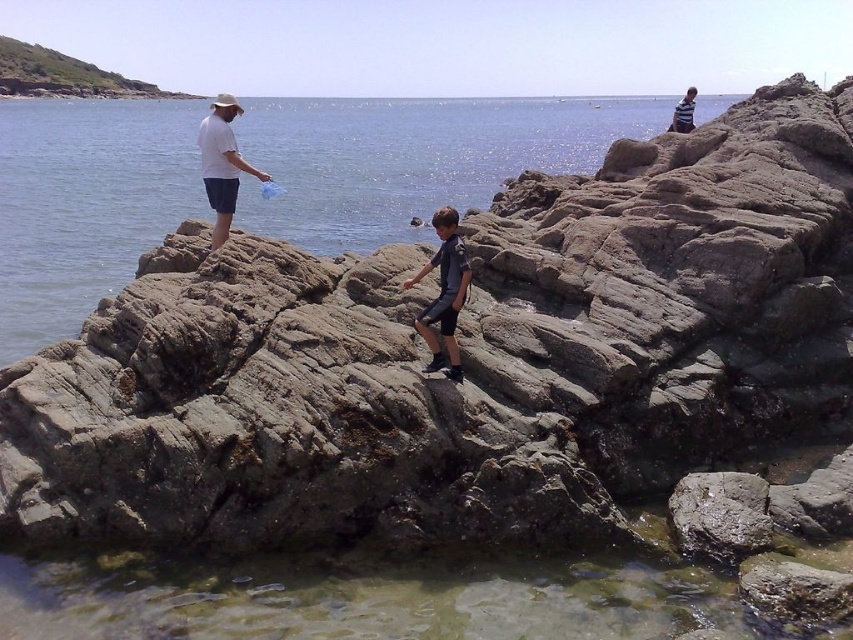
Question: Among these objects, which one is nearest to the camera?

Choices:
 (A) clear water at rocks center
 (B) gray rough rock at lower right
 (C) green grassy hillside at upper left
 (D) white matte shirt at upper left

Answer: (B)

Question: Does clear water at rocks center appear over white matte shirt at upper left?

Choices:
 (A) yes
 (B) no

Answer: (A)

Question: Which point is closer to the camera?

Choices:
 (A) (51, 76)
 (B) (201, 125)
 (C) (340, 243)
 (D) (691, 552)

Answer: (D)

Question: Is green grassy hillside at upper left bigger than white matte shirt at upper left?

Choices:
 (A) yes
 (B) no

Answer: (A)

Question: Which point is farther from the camera taking this photo?

Choices:
 (A) (97, 81)
 (B) (683, 122)
 (C) (459, 157)

Answer: (A)

Question: Is clear water at rocks center positioned before green grassy hillside at upper left?

Choices:
 (A) no
 (B) yes

Answer: (B)